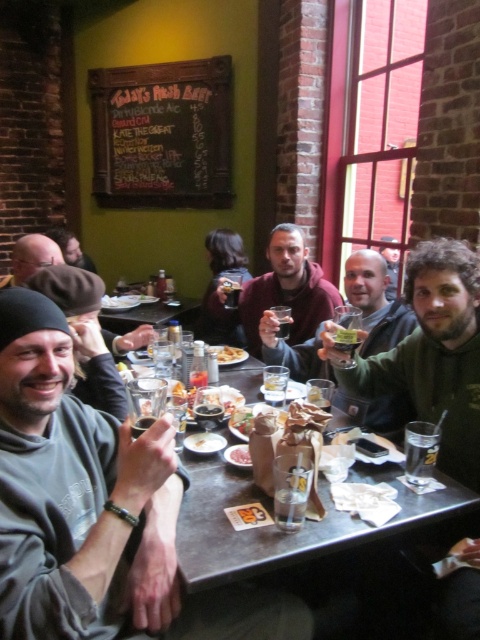
Is matte black hoodie at center closer to the viewer compared to smooth brown bread at center?

No, matte black hoodie at center is further to the viewer.

How far apart are matte black hoodie at center and smooth brown bread at center?

matte black hoodie at center and smooth brown bread at center are 22.89 inches apart.

Is point (367, 284) less distant than point (355, 337)?

No, (367, 284) is behind (355, 337).

At what (x,y) coordinates should I click in order to perform the action: click on matte black hoodie at center. Please return your answer as a coordinate pair (x, y). The width and height of the screenshot is (480, 640). Looking at the image, I should click on (375, 304).

Is matte black beanie at upper left wider than smooth brown bread at center?

Yes, matte black beanie at upper left is wider than smooth brown bread at center.

Between matte black beanie at upper left and smooth brown bread at center, which one appears on the right side from the viewer's perspective?

smooth brown bread at center is more to the right.

Between point (14, 244) and point (340, 330), which one is positioned behind?

The point (14, 244) is behind.

Locate an element on the screen. The image size is (480, 640). matte black beanie at upper left is located at coordinates (31, 257).

Does matte black beanie at lower left have a smaller size compared to black matte table at center?

Correct, matte black beanie at lower left occupies less space than black matte table at center.

Who is more forward, (x=38, y=266) or (x=184, y=312)?

Point (x=38, y=266) is in front.

Where is `matte black beanie at lower left`? The height and width of the screenshot is (640, 480). matte black beanie at lower left is located at coordinates pyautogui.click(x=32, y=257).